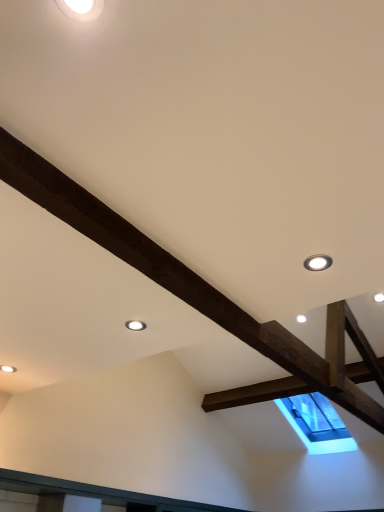
Question: Is matte white droplight at upper right, arranged as the second droplight when viewed from the top, at the left side of matte white droplight at upper center, which ranks as the first droplight in back-to-front order?

Choices:
 (A) yes
 (B) no

Answer: (B)

Question: Is matte white droplight at upper right, arranged as the second droplight when viewed from the top, at the right side of matte white droplight at upper center, which ranks as the first droplight in back-to-front order?

Choices:
 (A) yes
 (B) no

Answer: (A)

Question: Is matte white droplight at upper right, which is counted as the first droplight, starting from the right, looking in the opposite direction of matte white droplight at upper center, positioned as the 3th droplight in front-to-back order?

Choices:
 (A) yes
 (B) no

Answer: (B)

Question: Is matte white droplight at upper right, positioned as the second droplight in bottom-to-top order, not within matte white droplight at upper center, positioned as the 3th droplight in front-to-back order?

Choices:
 (A) no
 (B) yes

Answer: (B)

Question: Can you confirm if matte white droplight at upper right, positioned as the second droplight in bottom-to-top order, is bigger than matte white droplight at upper center, the 3th droplight when ordered from top to bottom?

Choices:
 (A) yes
 (B) no

Answer: (A)

Question: In the image, is matte white droplight at upper center, the 3th droplight when ordered from top to bottom, positioned in front of or behind white glossy droplight at upper left, placed as the 1th droplight when sorted from top to bottom?

Choices:
 (A) front
 (B) behind

Answer: (B)

Question: Based on their positions, is matte white droplight at upper center, the first droplight from the bottom, located to the left or right of white glossy droplight at upper left, positioned as the 2th droplight in left-to-right order?

Choices:
 (A) left
 (B) right

Answer: (A)

Question: Considering the positions of matte white droplight at upper center, the 3th droplight when ordered from top to bottom, and white glossy droplight at upper left, which ranks as the 1th droplight in front-to-back order, in the image, is matte white droplight at upper center, the 3th droplight when ordered from top to bottom, taller or shorter than white glossy droplight at upper left, which ranks as the 1th droplight in front-to-back order,?

Choices:
 (A) short
 (B) tall

Answer: (A)

Question: Would you say matte white droplight at upper center, which ranks as the first droplight in back-to-front order, is inside or outside white glossy droplight at upper left, positioned as the 2th droplight in left-to-right order?

Choices:
 (A) outside
 (B) inside

Answer: (A)

Question: Is point (311, 256) closer or farther from the camera than point (127, 327)?

Choices:
 (A) closer
 (B) farther

Answer: (A)

Question: From a real-world perspective, is matte white droplight at upper right, acting as the second droplight starting from the front, physically located above or below matte white droplight at upper center, which is counted as the 1th droplight, starting from the left?

Choices:
 (A) above
 (B) below

Answer: (A)

Question: Looking at their shapes, would you say matte white droplight at upper right, the 3th droplight when ordered from left to right, is wider or thinner than matte white droplight at upper center, the 3th droplight when ordered from top to bottom?

Choices:
 (A) wide
 (B) thin

Answer: (A)

Question: Is matte white droplight at upper right, the 3th droplight when ordered from left to right, taller or shorter than matte white droplight at upper center, which ranks as the 3th droplight in right-to-left order?

Choices:
 (A) tall
 (B) short

Answer: (A)

Question: Choose the correct answer: Is white glossy droplight at upper left, placed as the 1th droplight when sorted from top to bottom, inside matte white droplight at upper center, which ranks as the 3th droplight in right-to-left order, or outside it?

Choices:
 (A) outside
 (B) inside

Answer: (A)

Question: In terms of height, does white glossy droplight at upper left, the third droplight ordered from the bottom, look taller or shorter compared to matte white droplight at upper center, which ranks as the first droplight in back-to-front order?

Choices:
 (A) short
 (B) tall

Answer: (B)